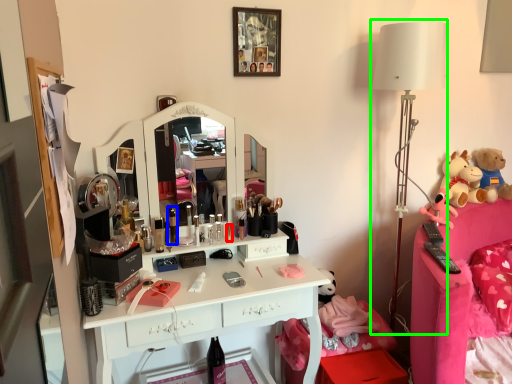
Question: Which is farther away from toiletry (highlighted by a red box)? toiletry (highlighted by a blue box) or table lamp (highlighted by a green box)?

Choices:
 (A) toiletry
 (B) table lamp

Answer: (B)